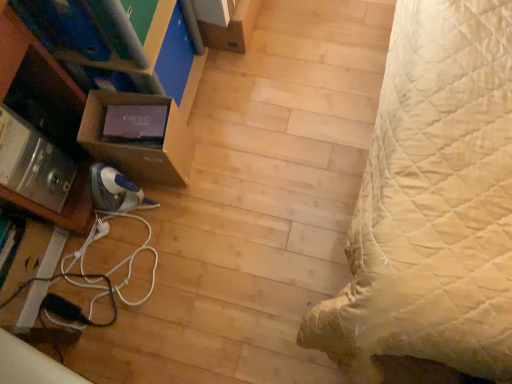
Find the location of `free spot below white cord at lower left (from a real-world perspective)`. free spot below white cord at lower left (from a real-world perspective) is located at coordinates (130, 271).